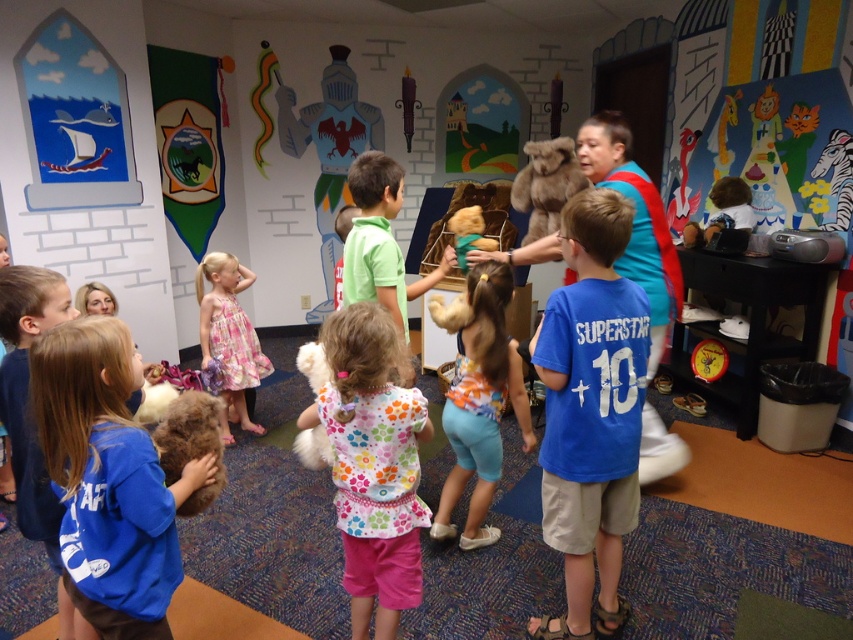
Who is positioned more to the right, fluffy brown teddy bear at center or gray metallic knight at center?

Positioned to the right is fluffy brown teddy bear at center.

In the scene shown: Does fluffy brown teddy bear at center appear over gray metallic knight at center?

No, fluffy brown teddy bear at center is not above gray metallic knight at center.

You are a GUI agent. You are given a task and a screenshot of the screen. Output one action in this format:
    pyautogui.click(x=<x>, y=<y>)
    Task: Click on the fluffy brown teddy bear at center
    This screenshot has height=640, width=853.
    Given the screenshot: What is the action you would take?
    pyautogui.click(x=479, y=400)

Between soft brown teddy bear at lower left and gray metallic knight at center, which one appears on the left side from the viewer's perspective?

Positioned to the left is gray metallic knight at center.

How distant is soft brown teddy bear at lower left from gray metallic knight at center?

The distance of soft brown teddy bear at lower left from gray metallic knight at center is 4.35 meters.

Which is behind, point (129, 506) or point (318, 305)?

Point (318, 305)

The height and width of the screenshot is (640, 853). In order to click on soft brown teddy bear at lower left in this screenshot , I will do `click(108, 477)`.

Which is in front, point (635, 484) or point (242, 364)?

Point (635, 484) is in front.

Which of these two, blue cotton shirt at center or floral dress at center, stands taller?

Standing taller between the two is blue cotton shirt at center.

Between point (575, 628) and point (223, 371), which one is positioned in front?

Point (575, 628)

You are a GUI agent. You are given a task and a screenshot of the screen. Output one action in this format:
    pyautogui.click(x=<x>, y=<y>)
    Task: Click on the blue cotton shirt at center
    This screenshot has height=640, width=853.
    Given the screenshot: What is the action you would take?
    pyautogui.click(x=590, y=412)